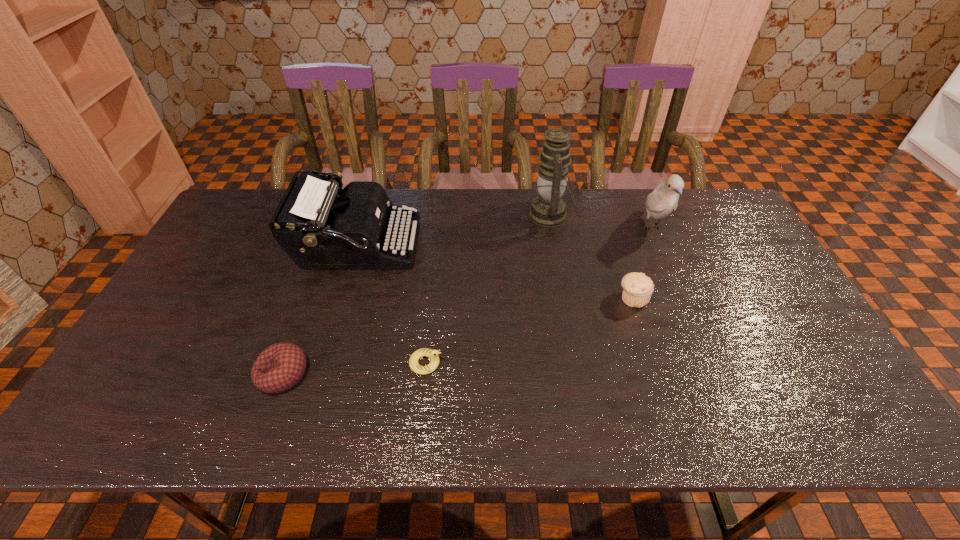
You are a GUI agent. You are given a task and a screenshot of the screen. Output one action in this format:
    pyautogui.click(x=<x>, y=<y>)
    Task: Click on the vacant space positioned 0.180m at the beak of the rightmost object
    The width and height of the screenshot is (960, 540).
    Given the screenshot: What is the action you would take?
    pyautogui.click(x=680, y=291)

Identify the location of vacant position located on the typing side of the third tallest object. The image size is (960, 540). (516, 246).

Where is `blank area located on the back of the fourth farthest object`? The image size is (960, 540). blank area located on the back of the fourth farthest object is located at coordinates (612, 234).

Image resolution: width=960 pixels, height=540 pixels. Identify the location of free location located 0.160m on the right of the beanbag. (375, 374).

The image size is (960, 540). Identify the location of free region located 0.280m on the face of the shortest object. (557, 363).

Identify the location of oil lamp that is at the far edge. The height and width of the screenshot is (540, 960). (548, 209).

Locate an element on the screen. Image resolution: width=960 pixels, height=540 pixels. bird located in the far edge section of the desktop is located at coordinates (663, 200).

At what (x,y) coordinates should I click in order to perform the action: click on typewriter at the far edge. Please return your answer as a coordinate pair (x, y). This screenshot has width=960, height=540. Looking at the image, I should click on (318, 230).

At what (x,y) coordinates should I click in order to perform the action: click on vacant space at the far edge of the desktop. Please return your answer as a coordinate pair (x, y). Looking at the image, I should click on tap(485, 231).

In order to click on vacant space at the near edge of the desktop in this screenshot , I will do `click(263, 437)`.